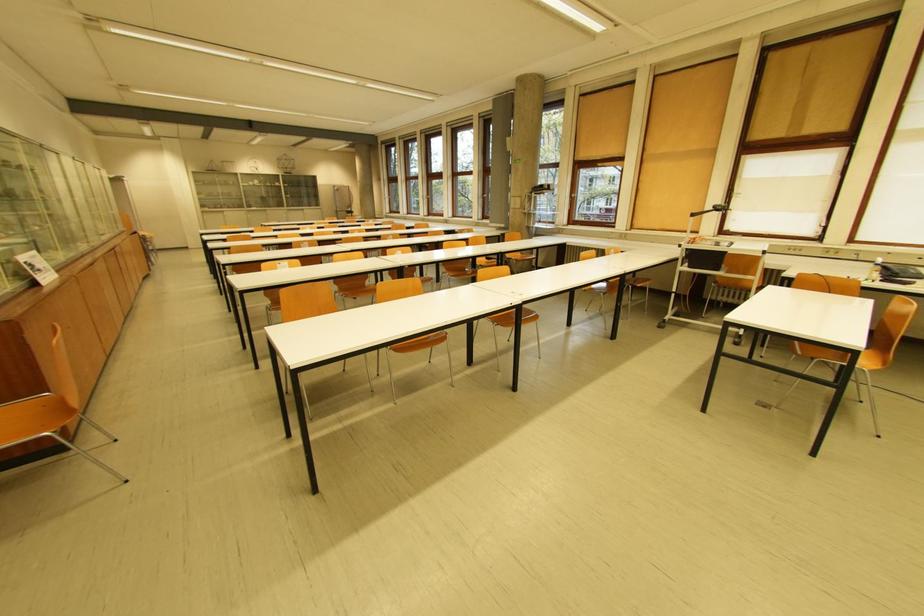
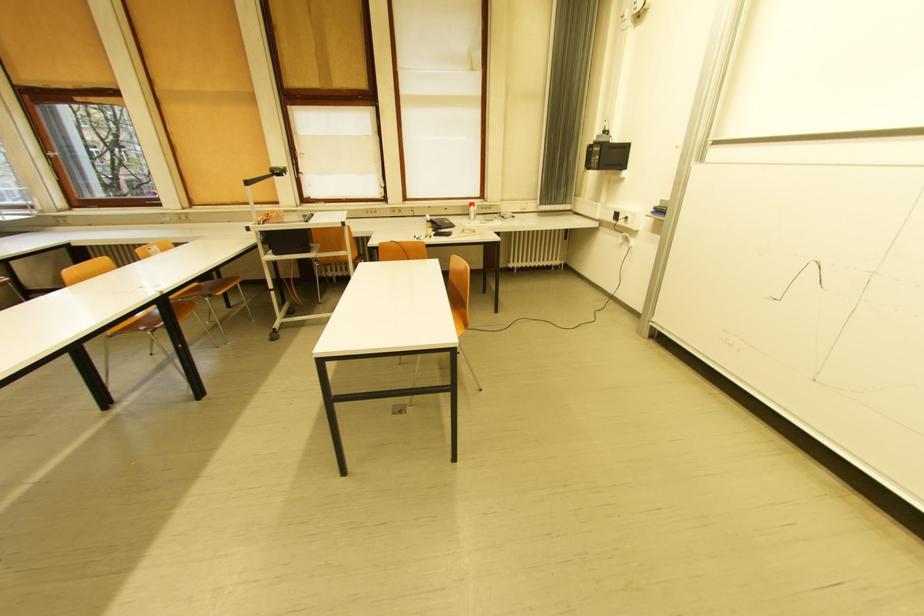
The point at (888,262) is marked in the first image. Where is the corresponding point in the second image?

(434, 219)